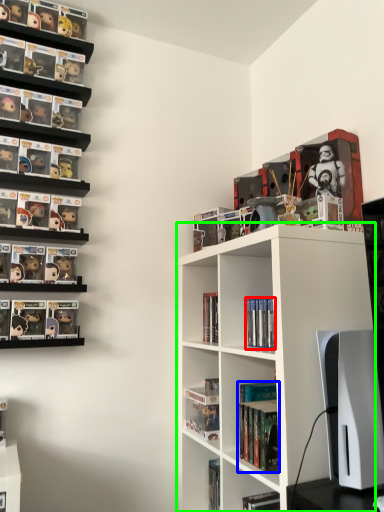
Question: Which object is positioned farthest from book (highlighted by a red box)? Select from book (highlighted by a blue box) and shelf (highlighted by a green box).

Choices:
 (A) book
 (B) shelf

Answer: (B)